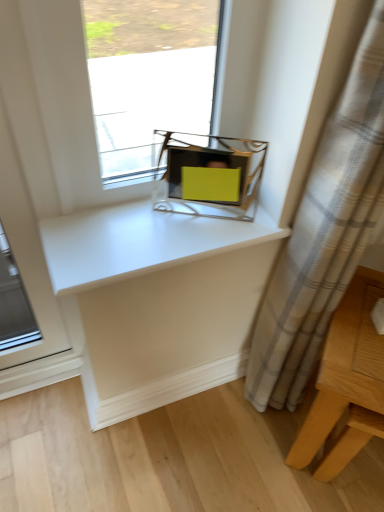
Question: Can you confirm if matte yellow plastic at center is smaller than light wood table at lower right?

Choices:
 (A) no
 (B) yes

Answer: (B)

Question: Is matte yellow plastic at center oriented away from light wood table at lower right?

Choices:
 (A) yes
 (B) no

Answer: (B)

Question: From a real-world perspective, is matte yellow plastic at center positioned over light wood table at lower right based on gravity?

Choices:
 (A) yes
 (B) no

Answer: (A)

Question: From the image's perspective, is matte yellow plastic at center below light wood table at lower right?

Choices:
 (A) no
 (B) yes

Answer: (A)

Question: Is matte yellow plastic at center positioned behind light wood table at lower right?

Choices:
 (A) no
 (B) yes

Answer: (B)

Question: In the image, is white glossy counter top at center positioned in front of or behind matte yellow plastic at center?

Choices:
 (A) front
 (B) behind

Answer: (A)

Question: From a real-world perspective, is white glossy counter top at center positioned above or below matte yellow plastic at center?

Choices:
 (A) below
 (B) above

Answer: (A)

Question: Is white glossy counter top at center inside or outside of matte yellow plastic at center?

Choices:
 (A) outside
 (B) inside

Answer: (A)

Question: Based on their sizes in the image, would you say white glossy counter top at center is bigger or smaller than matte yellow plastic at center?

Choices:
 (A) small
 (B) big

Answer: (B)

Question: Is point click(162, 186) closer or farther from the camera than point click(261, 217)?

Choices:
 (A) farther
 (B) closer

Answer: (A)

Question: From the image's perspective, relative to white glossy counter top at center, is matte yellow plastic at center above or below?

Choices:
 (A) below
 (B) above

Answer: (B)

Question: In terms of height, does matte yellow plastic at center look taller or shorter compared to white glossy counter top at center?

Choices:
 (A) tall
 (B) short

Answer: (A)

Question: In terms of size, does matte yellow plastic at center appear bigger or smaller than white glossy counter top at center?

Choices:
 (A) big
 (B) small

Answer: (B)

Question: Choose the correct answer: Is matte yellow plastic at center inside light wood table at lower right or outside it?

Choices:
 (A) outside
 (B) inside

Answer: (A)

Question: Is point (185, 184) closer or farther from the camera than point (357, 272)?

Choices:
 (A) closer
 (B) farther

Answer: (A)